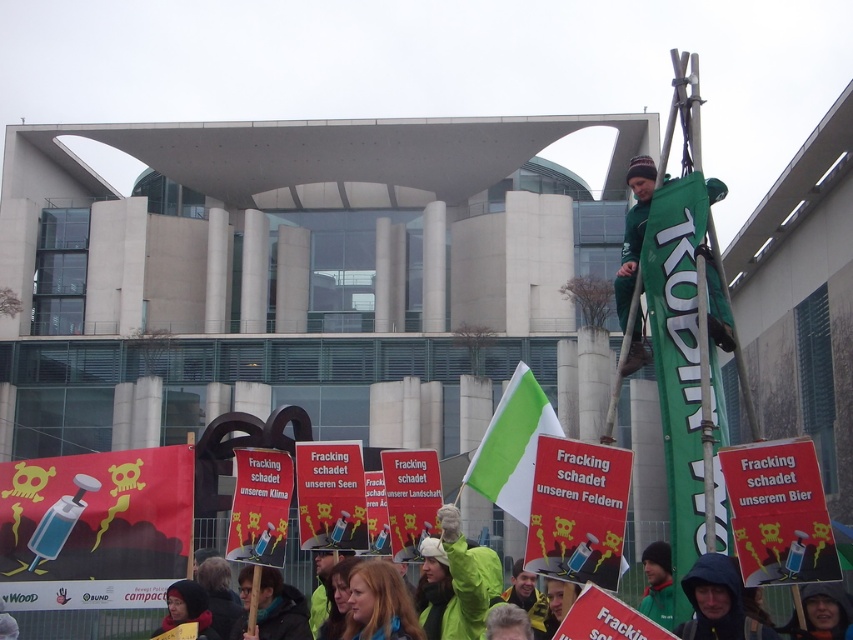
Question: Does green fabric flag at center appear over green fabric banner at upper right?

Choices:
 (A) yes
 (B) no

Answer: (B)

Question: Can you confirm if green fabric flag at center is positioned to the left of green fabric banner at upper right?

Choices:
 (A) no
 (B) yes

Answer: (B)

Question: Which of the following is the farthest from the observer?

Choices:
 (A) green fabric flag at center
 (B) green fabric scarf at lower center

Answer: (B)

Question: Is green fabric flag at center closer to camera compared to green fabric banner at upper right?

Choices:
 (A) no
 (B) yes

Answer: (B)

Question: Which object is the closest to the green fabric banner at upper right?

Choices:
 (A) green fabric scarf at lower center
 (B) green fabric flag at center

Answer: (B)

Question: Which object is the closest to the green fabric flag at center?

Choices:
 (A) green fabric banner at upper right
 (B) green fabric scarf at lower center

Answer: (A)